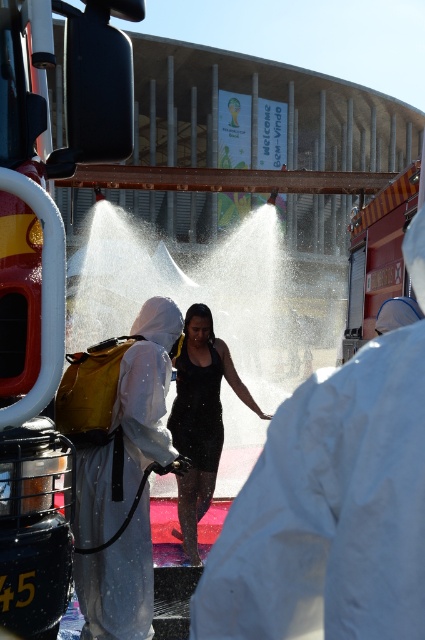
Locate an element on the screen. white protective suit at center is located at coordinates (119, 467).

Does white protective suit at center have a greater height compared to black matte dress at center?

In fact, white protective suit at center may be shorter than black matte dress at center.

Who is more forward, (139, 381) or (187, 321)?

Positioned in front is point (139, 381).

Locate an element on the screen. The height and width of the screenshot is (640, 425). white protective suit at center is located at coordinates (119, 467).

Is point (116, 145) positioned before point (141, 468)?

Yes, point (116, 145) is closer to viewer.

Is yellow metallic fire truck at left taller than white protective suit at center?

Yes, yellow metallic fire truck at left is taller than white protective suit at center.

Between point (48, 621) and point (68, 397), which one is positioned in front?

Point (48, 621) is in front.

The height and width of the screenshot is (640, 425). I want to click on yellow metallic fire truck at left, so click(x=53, y=176).

Which is in front, point (39, 573) or point (189, 499)?

Positioned in front is point (39, 573).

Between yellow metallic fire truck at left and black matte dress at center, which one is positioned higher?

yellow metallic fire truck at left

The height and width of the screenshot is (640, 425). Identify the location of yellow metallic fire truck at left. (53, 176).